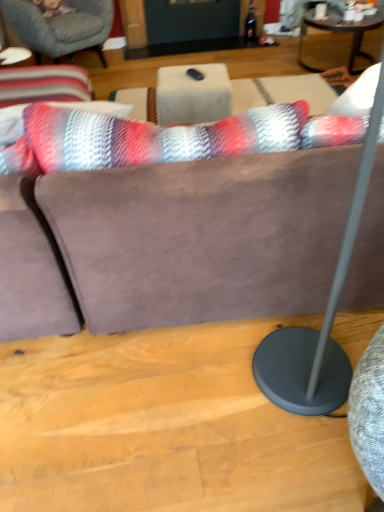
Question: Is matte gray floor lamp at right located within dark brown wooden coffee table at upper right?

Choices:
 (A) yes
 (B) no

Answer: (B)

Question: From a real-world perspective, is dark brown wooden coffee table at upper right physically above matte gray floor lamp at right?

Choices:
 (A) yes
 (B) no

Answer: (B)

Question: Can you confirm if dark brown wooden coffee table at upper right is positioned to the right of matte gray floor lamp at right?

Choices:
 (A) yes
 (B) no

Answer: (A)

Question: From a real-world perspective, is dark brown wooden coffee table at upper right beneath matte gray floor lamp at right?

Choices:
 (A) yes
 (B) no

Answer: (A)

Question: Does dark brown wooden coffee table at upper right have a lesser height compared to matte gray floor lamp at right?

Choices:
 (A) yes
 (B) no

Answer: (A)

Question: Is dark brown wooden coffee table at upper right touching matte gray floor lamp at right?

Choices:
 (A) yes
 (B) no

Answer: (B)

Question: Considering the relative sizes of matte gray floor lamp at right and white marble table at center in the image provided, is matte gray floor lamp at right bigger than white marble table at center?

Choices:
 (A) no
 (B) yes

Answer: (B)

Question: Is matte gray floor lamp at right facing away from white marble table at center?

Choices:
 (A) yes
 (B) no

Answer: (B)

Question: From the image's perspective, would you say matte gray floor lamp at right is positioned over white marble table at center?

Choices:
 (A) yes
 (B) no

Answer: (B)

Question: Is matte gray floor lamp at right closer to camera compared to white marble table at center?

Choices:
 (A) yes
 (B) no

Answer: (A)

Question: Is matte gray floor lamp at right to the left of white marble table at center from the viewer's perspective?

Choices:
 (A) no
 (B) yes

Answer: (A)

Question: Can we say matte gray floor lamp at right lies outside white marble table at center?

Choices:
 (A) no
 (B) yes

Answer: (B)

Question: Is white marble table at center completely or partially outside of striped fabric cushion at upper left?

Choices:
 (A) no
 (B) yes

Answer: (B)